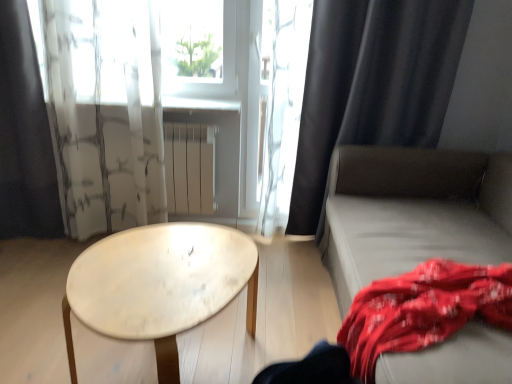
Describe the element at coordinates (190, 167) in the screenshot. This screenshot has width=512, height=384. I see `white matte radiator at center` at that location.

Describe the element at coordinates (24, 135) in the screenshot. The height and width of the screenshot is (384, 512). I see `black fabric curtain at left, arranged as the 1th curtain when viewed from the left` at that location.

This screenshot has height=384, width=512. In order to click on white marble table at center in this screenshot , I will do `click(159, 285)`.

Where is `black matte curtain at right, the third curtain viewed from the left`? black matte curtain at right, the third curtain viewed from the left is located at coordinates (372, 85).

In order to click on transparent glass window screen at upper center in this screenshot , I will do `click(192, 40)`.

Identify the location of translucent white curtain at upper center, which ranks as the 2th curtain in left-to-right order. The height and width of the screenshot is (384, 512). (104, 115).

I want to click on white matte radiator at center, so click(x=190, y=167).

How different are the orientations of white marble table at center and translucent white curtain at upper center, the second curtain from the right, in degrees?

They differ by 90.3 degrees in their facing directions.

Considering the relative sizes of white marble table at center and translucent white curtain at upper center, the second curtain from the right, in the image provided, is white marble table at center bigger than translucent white curtain at upper center, the second curtain from the right,?

Incorrect, white marble table at center is not larger than translucent white curtain at upper center, the second curtain from the right.

The image size is (512, 384). In order to click on table in front of the translucent white curtain at upper center, which ranks as the 2th curtain in left-to-right order in this screenshot , I will do `click(159, 285)`.

From a real-world perspective, is white marble table at center positioned above or below translucent white curtain at upper center, which ranks as the 2th curtain in left-to-right order?

In terms of real-world spatial position, white marble table at center is below translucent white curtain at upper center, which ranks as the 2th curtain in left-to-right order.

From a real-world perspective, which object rests below the other?

From a 3D spatial view, red cotton blanket at lower right is below.

From the picture: Relative to black fabric curtain at left, arranged as the 1th curtain when viewed from the left, is red cotton blanket at lower right in front or behind?

In the image, red cotton blanket at lower right appears in front of black fabric curtain at left, arranged as the 1th curtain when viewed from the left.

Identify the location of blanket that appears in front of the black fabric curtain at left, arranged as the 1th curtain when viewed from the left. The width and height of the screenshot is (512, 384). click(x=422, y=310).

From the image's perspective, is red cotton blanket at lower right on top of black fabric curtain at left, arranged as the 1th curtain when viewed from the left?

No, from the image's perspective, red cotton blanket at lower right is not above black fabric curtain at left, arranged as the 1th curtain when viewed from the left.

From the image's perspective, between translucent white curtain at upper center, which ranks as the 2th curtain in left-to-right order, and red cotton blanket at lower right, which one is located above?

translucent white curtain at upper center, which ranks as the 2th curtain in left-to-right order.

Is translucent white curtain at upper center, the second curtain from the right, inside the boundaries of red cotton blanket at lower right, or outside?

translucent white curtain at upper center, the second curtain from the right, is not enclosed by red cotton blanket at lower right.

In terms of width, does translucent white curtain at upper center, which ranks as the 2th curtain in left-to-right order, look wider or thinner when compared to red cotton blanket at lower right?

Considering their sizes, translucent white curtain at upper center, which ranks as the 2th curtain in left-to-right order, looks slimmer than red cotton blanket at lower right.

Between point (194, 75) and point (188, 203), which one is positioned behind?

The point (188, 203) is farther from the camera.

Is transparent glass window screen at upper center next to white matte radiator at center and touching it?

There is a gap between transparent glass window screen at upper center and white matte radiator at center.

Would you say transparent glass window screen at upper center is outside white matte radiator at center?

transparent glass window screen at upper center lies outside white matte radiator at center's area.

Is light gray fabric couch at right a part of white matte radiator at center?

No, light gray fabric couch at right is not a part of white matte radiator at center.

Is point (185, 129) behind point (334, 186)?

Yes, point (185, 129) is behind point (334, 186).

Based on the photo, from a real-world perspective, is white matte radiator at center located higher than light gray fabric couch at right?

Yes, from a real-world perspective, white matte radiator at center is on top of light gray fabric couch at right.

Can you confirm if white matte radiator at center is positioned to the left of light gray fabric couch at right?

Yes.

Is black fabric curtain at left, arranged as the 1th curtain when viewed from the left, bigger than red cotton blanket at lower right?

Incorrect, black fabric curtain at left, arranged as the 1th curtain when viewed from the left, is not larger than red cotton blanket at lower right.

Is black fabric curtain at left, the third curtain when ordered from right to left, wider than red cotton blanket at lower right?

Incorrect, the width of black fabric curtain at left, the third curtain when ordered from right to left, does not surpass that of red cotton blanket at lower right.

From the image's perspective, which is below, black fabric curtain at left, arranged as the 1th curtain when viewed from the left, or red cotton blanket at lower right?

From the image's view, red cotton blanket at lower right is below.

Which is closer to the camera, (16, 12) or (507, 309)?

Point (16, 12) is positioned farther from the camera compared to point (507, 309).

Which is more to the left, black fabric curtain at left, arranged as the 1th curtain when viewed from the left, or black matte curtain at right, the third curtain viewed from the left?

black fabric curtain at left, arranged as the 1th curtain when viewed from the left.

Can you tell me how much black fabric curtain at left, the third curtain when ordered from right to left, and black matte curtain at right, which appears as the first curtain when viewed from the right, differ in facing direction?

0.000499 degrees.

Between black fabric curtain at left, the third curtain when ordered from right to left, and black matte curtain at right, the third curtain viewed from the left, which one has smaller width?

black fabric curtain at left, the third curtain when ordered from right to left.

Is point (15, 77) more distant than point (289, 211)?

No, (15, 77) is closer to viewer.

From the white marble table at center, count the 1st curtain to the left and point to it. Please provide its 2D coordinates.

[(104, 115)]

This screenshot has width=512, height=384. In order to click on blanket in front of the black fabric curtain at left, the third curtain when ordered from right to left in this screenshot , I will do `click(422, 310)`.

When comparing their distances from white marble table at center, does transparent glass window screen at upper center or black matte curtain at right, which appears as the first curtain when viewed from the right, seem closer?

Based on the image, black matte curtain at right, which appears as the first curtain when viewed from the right, appears to be nearer to white marble table at center.

Which object lies nearer to the anchor point white marble table at center, red cotton blanket at lower right or black fabric curtain at left, arranged as the 1th curtain when viewed from the left?

red cotton blanket at lower right lies closer to white marble table at center than the other object.

Based on their spatial positions, is black matte curtain at right, which appears as the first curtain when viewed from the right, or transparent glass window screen at upper center further from white matte radiator at center?

black matte curtain at right, which appears as the first curtain when viewed from the right, lies further to white matte radiator at center than the other object.

Consider the image. Estimate the real-world distances between objects in this image. Which object is closer to transparent glass window screen at upper center, black matte curtain at right, the third curtain viewed from the left, or translucent white curtain at upper center, the second curtain from the right?

translucent white curtain at upper center, the second curtain from the right.

Estimate the real-world distances between objects in this image. Which object is closer to white marble table at center, translucent white curtain at upper center, the second curtain from the right, or red cotton blanket at lower right?

red cotton blanket at lower right is positioned closer to the anchor white marble table at center.

Based on the photo, which object lies nearer to the anchor point black matte curtain at right, the third curtain viewed from the left, light gray fabric couch at right or white matte radiator at center?

light gray fabric couch at right lies closer to black matte curtain at right, the third curtain viewed from the left, than the other object.

Considering their positions, is light gray fabric couch at right positioned closer to white matte radiator at center than transparent glass window screen at upper center?

transparent glass window screen at upper center is closer to white matte radiator at center.

Estimate the real-world distances between objects in this image. Which object is further from white marble table at center, translucent white curtain at upper center, the second curtain from the right, or black fabric curtain at left, the third curtain when ordered from right to left?

Among the two, black fabric curtain at left, the third curtain when ordered from right to left, is located further to white marble table at center.

At what (x,y) coordinates should I click in order to perform the action: click on window screen situated between black fabric curtain at left, the third curtain when ordered from right to left, and red cotton blanket at lower right from left to right. Please return your answer as a coordinate pair (x, y). This screenshot has width=512, height=384. Looking at the image, I should click on (192, 40).

Locate an element on the screen. table between translucent white curtain at upper center, the second curtain from the right, and black matte curtain at right, the third curtain viewed from the left, from left to right is located at coordinates (159, 285).

Find the location of a particular element. The width and height of the screenshot is (512, 384). window screen between translucent white curtain at upper center, the second curtain from the right, and red cotton blanket at lower right from left to right is located at coordinates (192, 40).

Locate an element on the screen. This screenshot has height=384, width=512. window screen positioned between white marble table at center and white matte radiator at center from near to far is located at coordinates (192, 40).